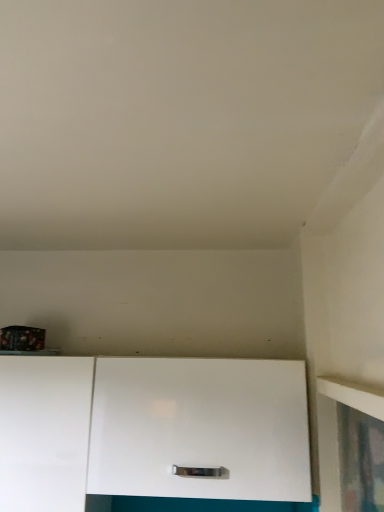
Question: From a real-world perspective, is white glossy cabinet at lower left, arranged as the first cabinetry when viewed from the left, positioned under white glossy cabinet at center, placed as the 1th cabinetry when sorted from right to left, based on gravity?

Choices:
 (A) no
 (B) yes

Answer: (B)

Question: Could you tell me if white glossy cabinet at lower left, the second cabinetry from the right, is turned towards white glossy cabinet at center, placed as the 1th cabinetry when sorted from right to left?

Choices:
 (A) yes
 (B) no

Answer: (B)

Question: Considering the relative positions of white glossy cabinet at lower left, the second cabinetry from the right, and white glossy cabinet at center, the 2th cabinetry from the left, in the image provided, is white glossy cabinet at lower left, the second cabinetry from the right, to the left of white glossy cabinet at center, the 2th cabinetry from the left, from the viewer's perspective?

Choices:
 (A) yes
 (B) no

Answer: (A)

Question: Is white glossy cabinet at lower left, arranged as the first cabinetry when viewed from the left, to the right of white glossy cabinet at center, placed as the 1th cabinetry when sorted from right to left, from the viewer's perspective?

Choices:
 (A) yes
 (B) no

Answer: (B)

Question: From the image's perspective, is white glossy cabinet at lower left, the second cabinetry from the right, on white glossy cabinet at center, placed as the 1th cabinetry when sorted from right to left?

Choices:
 (A) yes
 (B) no

Answer: (B)

Question: Would you say white glossy cabinet at lower left, the second cabinetry from the right, is outside white glossy cabinet at center, placed as the 1th cabinetry when sorted from right to left?

Choices:
 (A) no
 (B) yes

Answer: (B)

Question: From the image's perspective, does white glossy cabinet at center, placed as the 1th cabinetry when sorted from right to left, appear lower than white glossy cabinet at lower left, the second cabinetry from the right?

Choices:
 (A) yes
 (B) no

Answer: (B)

Question: Is white glossy cabinet at center, the 2th cabinetry from the left, completely or partially outside of white glossy cabinet at lower left, arranged as the first cabinetry when viewed from the left?

Choices:
 (A) yes
 (B) no

Answer: (A)

Question: From the image's perspective, would you say white glossy cabinet at center, placed as the 1th cabinetry when sorted from right to left, is positioned over white glossy cabinet at lower left, the second cabinetry from the right?

Choices:
 (A) no
 (B) yes

Answer: (B)

Question: Is the position of white glossy cabinet at center, placed as the 1th cabinetry when sorted from right to left, less distant than that of white glossy cabinet at lower left, the second cabinetry from the right?

Choices:
 (A) yes
 (B) no

Answer: (A)

Question: Does white glossy cabinet at center, the 2th cabinetry from the left, contain white glossy cabinet at lower left, arranged as the first cabinetry when viewed from the left?

Choices:
 (A) no
 (B) yes

Answer: (A)

Question: From a real-world perspective, does white glossy cabinet at center, placed as the 1th cabinetry when sorted from right to left, stand above white glossy cabinet at lower left, the second cabinetry from the right?

Choices:
 (A) yes
 (B) no

Answer: (A)

Question: Considering the positions of white glossy cabinet at center, placed as the 1th cabinetry when sorted from right to left, and white glossy cabinet at lower left, the second cabinetry from the right, in the image, is white glossy cabinet at center, placed as the 1th cabinetry when sorted from right to left, taller or shorter than white glossy cabinet at lower left, the second cabinetry from the right,?

Choices:
 (A) tall
 (B) short

Answer: (B)